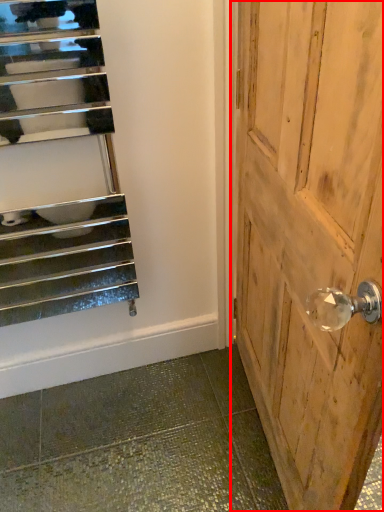
Question: Where is door (annotated by the red box) located in relation to stairs in the image?

Choices:
 (A) left
 (B) right

Answer: (B)